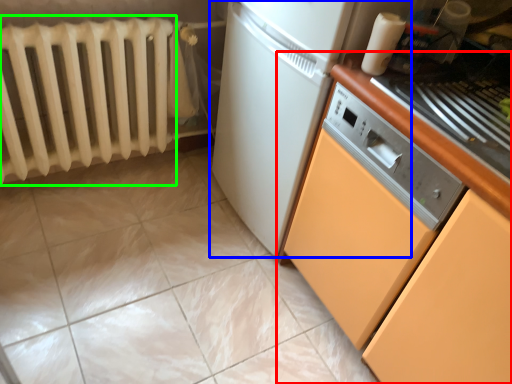
Question: Which object is positioned closest to cabinetry (highlighted by a red box)? Select from home appliance (highlighted by a blue box) and radiator (highlighted by a green box).

Choices:
 (A) home appliance
 (B) radiator

Answer: (A)